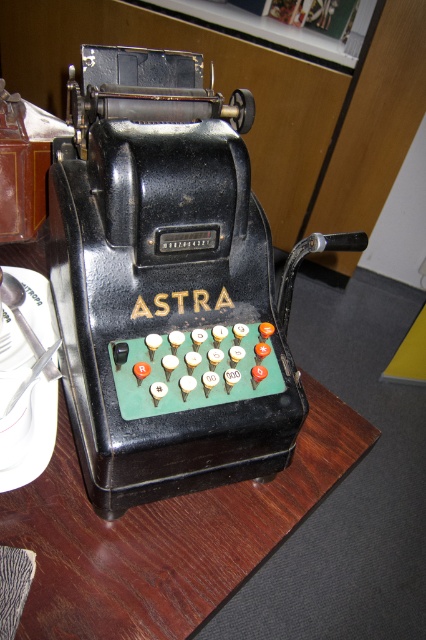
You are standing in front of an old mechanical calculator on a wooden table. The calculator has a green keyboard with white and red buttons. You want to place a 15 inch long ruler horizontally on the table next to the calculator. Is there enough space on the wooden table at center to accommodate the ruler?

The wooden table at center is 20.37 inches away from the viewer, but this distance does not indicate the table size. The question cannot be answered with the given information.

You are setting up a small snack for a math competition participant. You have a wooden table at center and a white glossy plate at lower left. Which surface is taller so the snack won

The white glossy plate at lower left is taller than the wooden table at center, so the snack should be placed on the white glossy plate at lower left to ensure it is elevated.

You are a customer at a vintage store and see the black matte register at center and the wooden table at center. Which object is bigger in size?

The black matte register at center is larger in size than the wooden table at center.